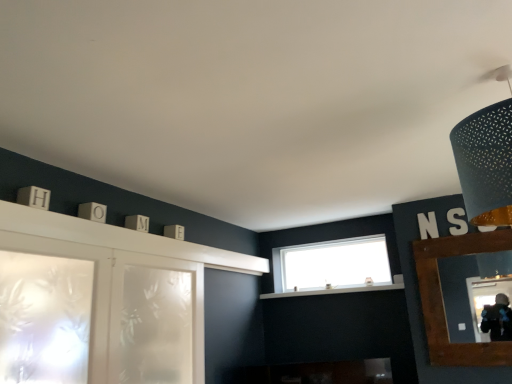
Question: Considering the relative positions of white glossy mantle at center and frosted glass screen door at lower left in the image provided, is white glossy mantle at center to the left of frosted glass screen door at lower left from the viewer's perspective?

Choices:
 (A) no
 (B) yes

Answer: (A)

Question: Could you tell me if white glossy mantle at center is turned towards frosted glass screen door at lower left?

Choices:
 (A) no
 (B) yes

Answer: (A)

Question: Does white glossy mantle at center have a smaller size compared to frosted glass screen door at lower left?

Choices:
 (A) no
 (B) yes

Answer: (B)

Question: Can you confirm if white glossy mantle at center is bigger than frosted glass screen door at lower left?

Choices:
 (A) yes
 (B) no

Answer: (B)

Question: Is white glossy mantle at center in front of frosted glass screen door at lower left?

Choices:
 (A) no
 (B) yes

Answer: (A)

Question: Is white glossy mantle at center completely or partially outside of frosted glass screen door at lower left?

Choices:
 (A) no
 (B) yes

Answer: (B)

Question: From the image's perspective, does brown wooden mirror at right appear higher than white glossy mantle at center?

Choices:
 (A) no
 (B) yes

Answer: (B)

Question: From a real-world perspective, is brown wooden mirror at right positioned under white glossy mantle at center based on gravity?

Choices:
 (A) yes
 (B) no

Answer: (A)

Question: Considering the relative sizes of brown wooden mirror at right and white glossy mantle at center in the image provided, is brown wooden mirror at right taller than white glossy mantle at center?

Choices:
 (A) yes
 (B) no

Answer: (A)

Question: Is brown wooden mirror at right positioned behind white glossy mantle at center?

Choices:
 (A) yes
 (B) no

Answer: (B)

Question: Can you confirm if brown wooden mirror at right is thinner than white glossy mantle at center?

Choices:
 (A) no
 (B) yes

Answer: (B)

Question: From the image's perspective, would you say brown wooden mirror at right is shown under white glossy mantle at center?

Choices:
 (A) no
 (B) yes

Answer: (A)

Question: Does matte black lampshade at upper right turn towards frosted glass screen door at lower left?

Choices:
 (A) no
 (B) yes

Answer: (A)